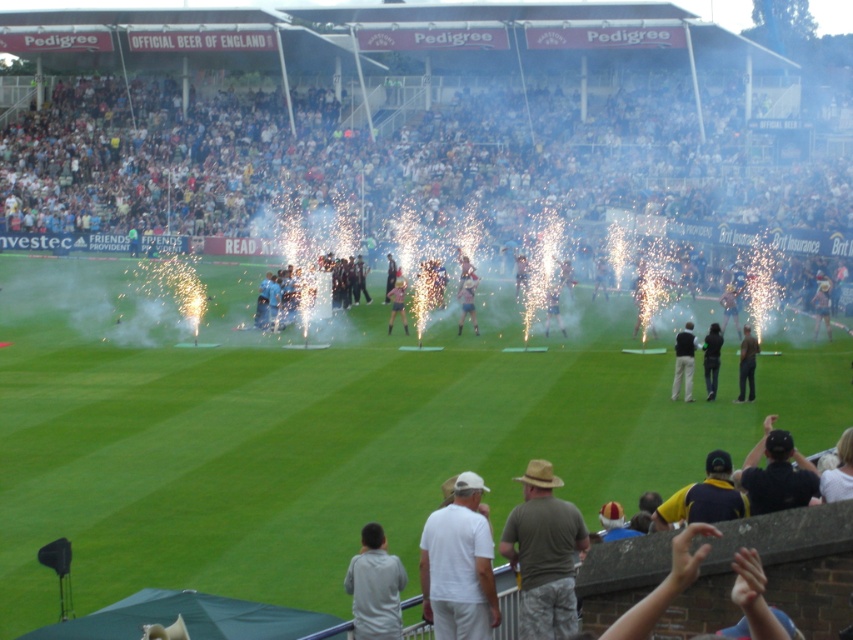
Which is above, black fabric jacket at center or light brown leather jacket at center?

light brown leather jacket at center is above.

From the picture: Is black fabric jacket at center closer to camera compared to light brown leather jacket at center?

Yes, black fabric jacket at center is in front of light brown leather jacket at center.

At what (x,y) coordinates should I click in order to perform the action: click on black fabric jacket at center. Please return your answer as a coordinate pair (x, y). Image resolution: width=853 pixels, height=640 pixels. Looking at the image, I should click on (683, 362).

What do you see at coordinates (544, 554) in the screenshot? I see `camouflage shorts at center` at bounding box center [544, 554].

Who is positioned more to the left, camouflage shorts at center or white cotton shirt at center?

Positioned to the left is white cotton shirt at center.

At what (x,y) coordinates should I click in order to perform the action: click on camouflage shorts at center. Please return your answer as a coordinate pair (x, y). The width and height of the screenshot is (853, 640). Looking at the image, I should click on (544, 554).

The image size is (853, 640). Identify the location of camouflage shorts at center. (544, 554).

Looking at this image, between white cotton crowd at upper center and light brown leather jacket at center, which one appears on the left side from the viewer's perspective?

From the viewer's perspective, white cotton crowd at upper center appears more on the left side.

Which is more to the right, white cotton crowd at upper center or light brown leather jacket at center?

light brown leather jacket at center

The height and width of the screenshot is (640, 853). I want to click on white cotton crowd at upper center, so click(373, 168).